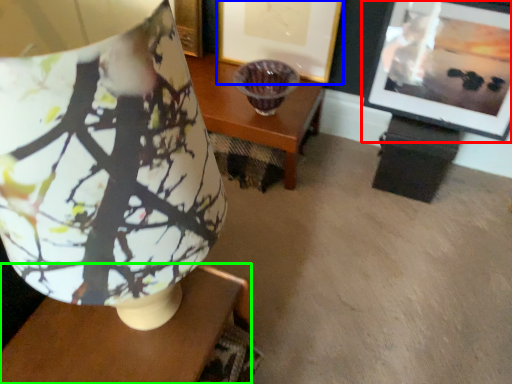
Question: Based on their relative distances, which object is farther from picture frame (highlighted by a red box)? Choose from picture frame (highlighted by a blue box) and table (highlighted by a green box).

Choices:
 (A) picture frame
 (B) table

Answer: (B)